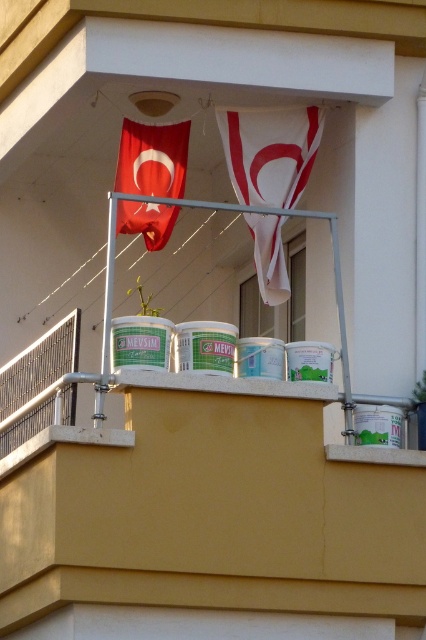
Does white fabric flag at center have a lesser width compared to matte red flag at upper left?

Incorrect, white fabric flag at center's width is not less than matte red flag at upper left's.

Which is below, white fabric flag at center or matte red flag at upper left?

white fabric flag at center is below.

The width and height of the screenshot is (426, 640). Describe the element at coordinates (270, 150) in the screenshot. I see `white fabric flag at center` at that location.

Find the location of a particular element. Image resolution: width=426 pixels, height=640 pixels. white fabric flag at center is located at coordinates (270, 150).